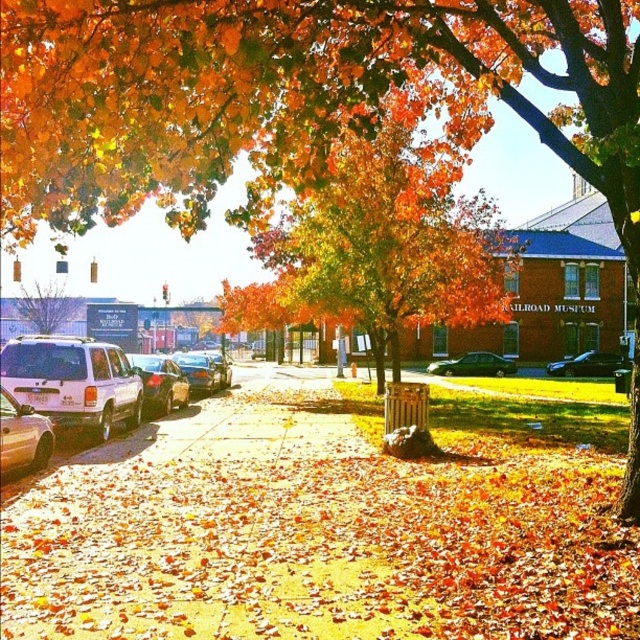
Question: Is white matte suv at left wider than brown textured tree at left?

Choices:
 (A) yes
 (B) no

Answer: (B)

Question: Which object is positioned closest to the brown textured tree at left?

Choices:
 (A) shiny silver sedan at left
 (B) white matte suv at left
 (C) metallic silver sedan at lower left
 (D) green matte car at center

Answer: (D)

Question: Where is shiny silver sedan at left located in relation to green matte car at center in the image?

Choices:
 (A) above
 (B) below

Answer: (A)

Question: Can you confirm if shiny silver sedan at left is positioned below shiny black sedan at center?

Choices:
 (A) yes
 (B) no

Answer: (B)

Question: Which of the following is the closest to the observer?

Choices:
 (A) yellow gravel at center
 (B) shiny black sedan at center
 (C) brown textured tree at left
 (D) metallic silver sedan at lower left

Answer: (A)

Question: Estimate the real-world distances between objects in this image. Which object is farther from the white matte suv at left?

Choices:
 (A) brown textured tree at left
 (B) shiny silver sedan at left

Answer: (A)